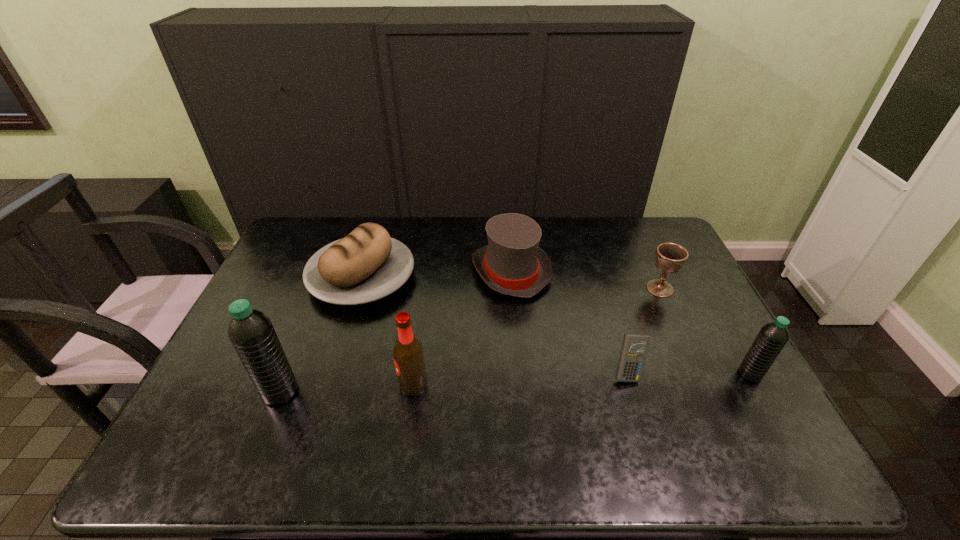
In the image, there is a desktop. At what (x,y) coordinates should I click in order to perform the action: click on free space at the left edge. Please return your answer as a coordinate pair (x, y). Looking at the image, I should click on (279, 321).

Locate an element on the screen. The height and width of the screenshot is (540, 960). vacant space at the right edge of the desktop is located at coordinates (676, 339).

Identify the location of free space at the near left corner. (198, 407).

At what (x,y) coordinates should I click in order to perform the action: click on free space at the far right corner. Please return your answer as a coordinate pair (x, y). The image size is (960, 540). Looking at the image, I should click on (638, 231).

You are a GUI agent. You are given a task and a screenshot of the screen. Output one action in this format:
    pyautogui.click(x=<x>, y=<y>)
    Task: Click on the empty location between the right water bottle and the left water bottle
    
    Given the screenshot: What is the action you would take?
    pyautogui.click(x=516, y=383)

This screenshot has width=960, height=540. Identify the location of blank region between the bread and the shorter water bottle. (556, 326).

You are a GUI agent. You are given a task and a screenshot of the screen. Output one action in this format:
    pyautogui.click(x=<x>, y=<y>)
    Task: Click on the vacant point located between the second tallest object and the bread
    Image resolution: width=960 pixels, height=540 pixels.
    Given the screenshot: What is the action you would take?
    pyautogui.click(x=388, y=330)

Identify the location of free space between the left water bottle and the calculator. (454, 382).

At what (x,y) coordinates should I click in order to perform the action: click on blank region between the shortest object and the fifth object from right to left. Please return your answer as a coordinate pair (x, y). This screenshot has height=540, width=960. Looking at the image, I should click on (520, 379).

In order to click on unoccupied position between the second object from right to left and the dress hat in this screenshot , I will do `click(586, 280)`.